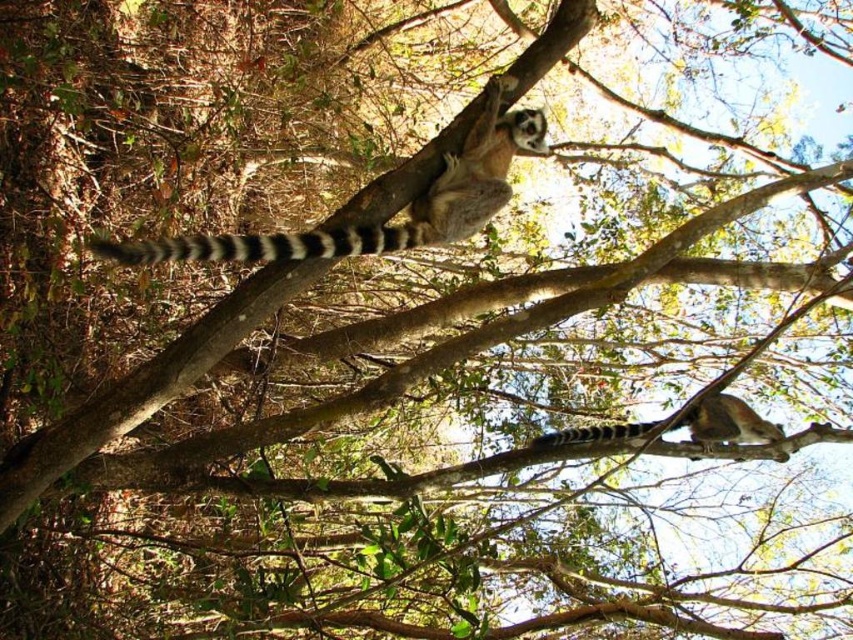
You are a wildlife photographer aiming to capture a closeup of the white striped tail at upper center. Your camera has a maximum focus range of 2 meters. Can you take the photo without moving closer?

The white striped tail at upper center is 2.44 meters away, which exceeds the camera maximum focus range of 2 meters. You need to move closer to take the photo.